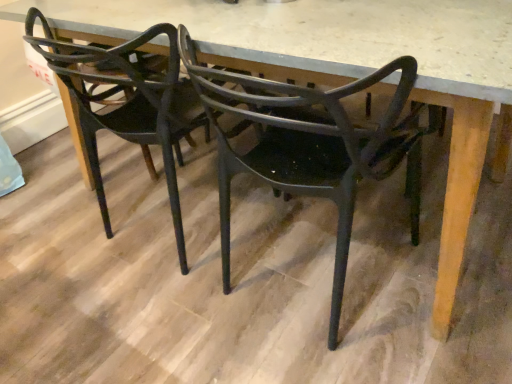
The image size is (512, 384). Describe the element at coordinates (128, 103) in the screenshot. I see `matte black chair at center, which appears as the second chair when viewed from the right` at that location.

Locate an element on the screen. This screenshot has width=512, height=384. matte black chair at center, acting as the 1th chair starting from the left is located at coordinates (128, 103).

Where is `matte black chair at center, the second chair from the left`? Image resolution: width=512 pixels, height=384 pixels. matte black chair at center, the second chair from the left is located at coordinates (312, 146).

This screenshot has width=512, height=384. What do you see at coordinates (312, 146) in the screenshot?
I see `matte black chair at center, the 1th chair in the right-to-left sequence` at bounding box center [312, 146].

Where is `matte black chair at center, acting as the 1th chair starting from the left`? Image resolution: width=512 pixels, height=384 pixels. matte black chair at center, acting as the 1th chair starting from the left is located at coordinates (128, 103).

Is matte black chair at center, which appears as the second chair when viewed from the right, to the left or to the right of matte black chair at center, the second chair from the left, in the image?

matte black chair at center, which appears as the second chair when viewed from the right, is positioned on matte black chair at center, the second chair from the left,'s left side.

Considering their positions, is matte black chair at center, acting as the 1th chair starting from the left, located in front of or behind matte black chair at center, the 1th chair in the right-to-left sequence?

Clearly, matte black chair at center, acting as the 1th chair starting from the left, is behind matte black chair at center, the 1th chair in the right-to-left sequence.

Which is less distant, (x=160, y=108) or (x=369, y=165)?

The point (x=369, y=165) is more forward.

From the image's perspective, which object appears higher, matte black chair at center, which appears as the second chair when viewed from the right, or matte black chair at center, the 1th chair in the right-to-left sequence?

matte black chair at center, which appears as the second chair when viewed from the right.

From a real-world perspective, is matte black chair at center, which appears as the second chair when viewed from the right, under matte black chair at center, the 1th chair in the right-to-left sequence?

No, from a real-world perspective, matte black chair at center, which appears as the second chair when viewed from the right, is not under matte black chair at center, the 1th chair in the right-to-left sequence.

Does matte black chair at center, which appears as the second chair when viewed from the right, have a greater width compared to matte black chair at center, the second chair from the left?

Correct, the width of matte black chair at center, which appears as the second chair when viewed from the right, exceeds that of matte black chair at center, the second chair from the left.

Is matte black chair at center, acting as the 1th chair starting from the left, taller or shorter than matte black chair at center, the second chair from the left?

Considering their sizes, matte black chair at center, acting as the 1th chair starting from the left, has less height than matte black chair at center, the second chair from the left.

Does matte black chair at center, acting as the 1th chair starting from the left, have a smaller size compared to matte black chair at center, the 1th chair in the right-to-left sequence?

Actually, matte black chair at center, acting as the 1th chair starting from the left, might be larger than matte black chair at center, the 1th chair in the right-to-left sequence.

Based on the photo, is matte black chair at center, the 1th chair in the right-to-left sequence, completely or partially inside matte black chair at center, acting as the 1th chair starting from the left?

No, matte black chair at center, the 1th chair in the right-to-left sequence, is not surrounded by matte black chair at center, acting as the 1th chair starting from the left.

Is matte black chair at center, acting as the 1th chair starting from the left, placed right next to matte black chair at center, the 1th chair in the right-to-left sequence?

They are not placed beside each other.

Is matte black chair at center, which appears as the second chair when viewed from the right, turned away from matte black chair at center, the second chair from the left?

matte black chair at center, which appears as the second chair when viewed from the right, is not turned away from matte black chair at center, the second chair from the left.

How different are the orientations of matte black chair at center, which appears as the second chair when viewed from the right, and matte black chair at center, the second chair from the left, in degrees?

The facing directions of matte black chair at center, which appears as the second chair when viewed from the right, and matte black chair at center, the second chair from the left, are 0.00146 degrees apart.

How much distance is there between matte black chair at center, which appears as the second chair when viewed from the right, and matte black chair at center, the 1th chair in the right-to-left sequence?

matte black chair at center, which appears as the second chair when viewed from the right, and matte black chair at center, the 1th chair in the right-to-left sequence, are 15.88 inches apart.

Locate an element on the screen. chair positioned vertically above the matte black chair at center, the second chair from the left (from a real-world perspective) is located at coordinates (128, 103).

Is matte black chair at center, the 1th chair in the right-to-left sequence, to the left or to the right of matte black chair at center, acting as the 1th chair starting from the left, in the image?

In the image, matte black chair at center, the 1th chair in the right-to-left sequence, appears on the right side of matte black chair at center, acting as the 1th chair starting from the left.

Considering the positions of objects matte black chair at center, the 1th chair in the right-to-left sequence, and matte black chair at center, which appears as the second chair when viewed from the right, in the image provided, who is in front, matte black chair at center, the 1th chair in the right-to-left sequence, or matte black chair at center, which appears as the second chair when viewed from the right,?

matte black chair at center, the 1th chair in the right-to-left sequence.

Which is nearer, (188, 52) or (102, 46)?

Point (188, 52) is closer to the camera than point (102, 46).

From the image's perspective, does matte black chair at center, the 1th chair in the right-to-left sequence, appear higher than matte black chair at center, which appears as the second chair when viewed from the right?

Incorrect, from the image's perspective, matte black chair at center, the 1th chair in the right-to-left sequence, is lower than matte black chair at center, which appears as the second chair when viewed from the right.

From a real-world perspective, who is located lower, matte black chair at center, the 1th chair in the right-to-left sequence, or matte black chair at center, which appears as the second chair when viewed from the right?

matte black chair at center, the 1th chair in the right-to-left sequence, from a real-world perspective.

Consider the image. Considering the sizes of objects matte black chair at center, the second chair from the left, and matte black chair at center, acting as the 1th chair starting from the left, in the image provided, who is wider, matte black chair at center, the second chair from the left, or matte black chair at center, acting as the 1th chair starting from the left,?

Wider between the two is matte black chair at center, acting as the 1th chair starting from the left.

Who is shorter, matte black chair at center, the second chair from the left, or matte black chair at center, acting as the 1th chair starting from the left?

Standing shorter between the two is matte black chair at center, acting as the 1th chair starting from the left.

From the picture: Can you confirm if matte black chair at center, the second chair from the left, is smaller than matte black chair at center, which appears as the second chair when viewed from the right?

Yes, matte black chair at center, the second chair from the left, is smaller than matte black chair at center, which appears as the second chair when viewed from the right.

Is matte black chair at center, the 1th chair in the right-to-left sequence, completely or partially outside of matte black chair at center, acting as the 1th chair starting from the left?

matte black chair at center, the 1th chair in the right-to-left sequence, is positioned outside matte black chair at center, acting as the 1th chair starting from the left.

Are matte black chair at center, the 1th chair in the right-to-left sequence, and matte black chair at center, which appears as the second chair when viewed from the right, beside each other?

No, matte black chair at center, the 1th chair in the right-to-left sequence, is not making contact with matte black chair at center, which appears as the second chair when viewed from the right.

Does matte black chair at center, the second chair from the left, turn towards matte black chair at center, which appears as the second chair when viewed from the right?

No, matte black chair at center, the second chair from the left, is not turned towards matte black chair at center, which appears as the second chair when viewed from the right.

How distant is matte black chair at center, the second chair from the left, from matte black chair at center, which appears as the second chair when viewed from the right?

A distance of 40.34 centimeters exists between matte black chair at center, the second chair from the left, and matte black chair at center, which appears as the second chair when viewed from the right.

Find the location of a particular element. chair located underneath the matte black chair at center, acting as the 1th chair starting from the left (from a real-world perspective) is located at coordinates (312, 146).

Locate an element on the screen. Image resolution: width=512 pixels, height=384 pixels. chair located on the right of matte black chair at center, which appears as the second chair when viewed from the right is located at coordinates (312, 146).

At what (x,y) coordinates should I click in order to perform the action: click on chair positioned vertically above the matte black chair at center, the second chair from the left (from a real-world perspective). Please return your answer as a coordinate pair (x, y). This screenshot has height=384, width=512. Looking at the image, I should click on (128, 103).